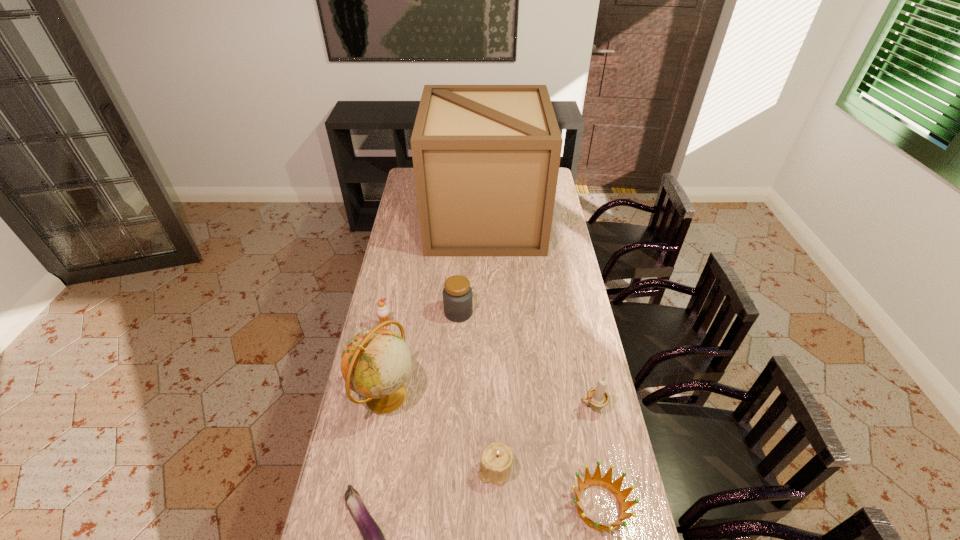
In order to click on box in this screenshot , I will do `click(486, 158)`.

Locate an element on the screen. Image resolution: width=960 pixels, height=540 pixels. the tallest object is located at coordinates (486, 158).

Locate an element on the screen. This screenshot has height=540, width=960. globe is located at coordinates (375, 363).

Where is `jar`? Image resolution: width=960 pixels, height=540 pixels. jar is located at coordinates (457, 294).

At what (x,y) coordinates should I click in order to perform the action: click on the taller candle_holder. Please return your answer as a coordinate pair (x, y). The width and height of the screenshot is (960, 540). Looking at the image, I should click on (598, 398).

Locate an element on the screen. the farther candle_holder is located at coordinates (598, 398).

Locate an element on the screen. icecream is located at coordinates (382, 310).

Locate an element on the screen. Image resolution: width=960 pixels, height=540 pixels. the shorter candle_holder is located at coordinates (497, 458).

Identify the location of the nearer candle_holder. (497, 458).

The height and width of the screenshot is (540, 960). Find the location of `free space located on the reinforced sides of the farthest object`. free space located on the reinforced sides of the farthest object is located at coordinates (411, 220).